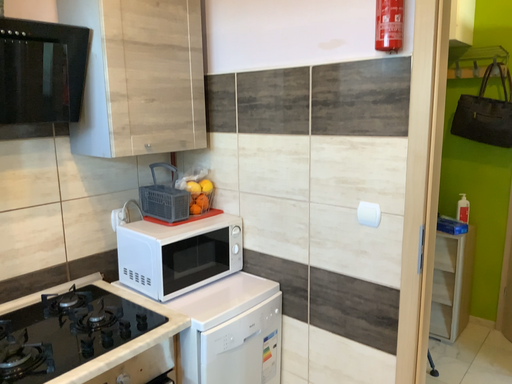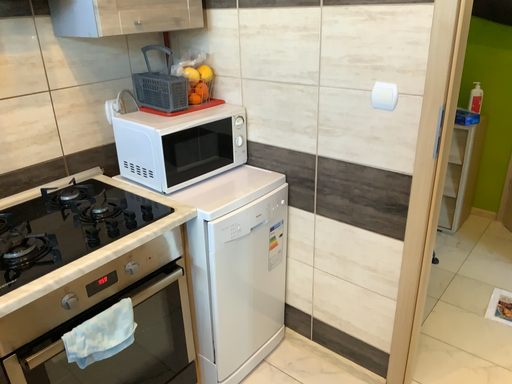
Question: How did the camera likely rotate when shooting the video?

Choices:
 (A) rotated downward
 (B) rotated upward

Answer: (A)